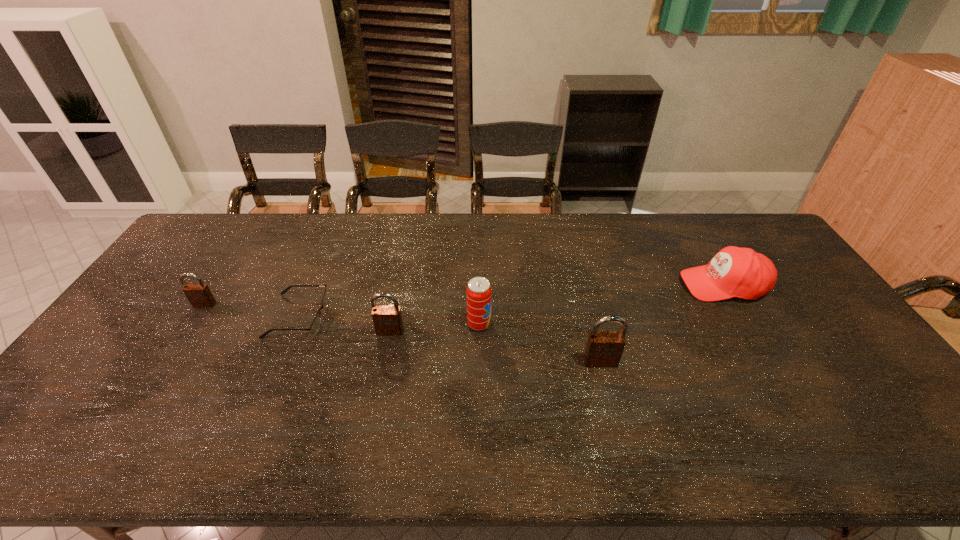
Given the evenly spaced padlocks in the image, where should an extra padlock be added on the right to preserve the spacing? Please point to a vacant space. Please provide its 2D coordinates. Your answer should be formatted as a tuple, i.e. [(x, y)], where the tuple contains the x and y coordinates of a point satisfying the conditions above.

[(842, 397)]